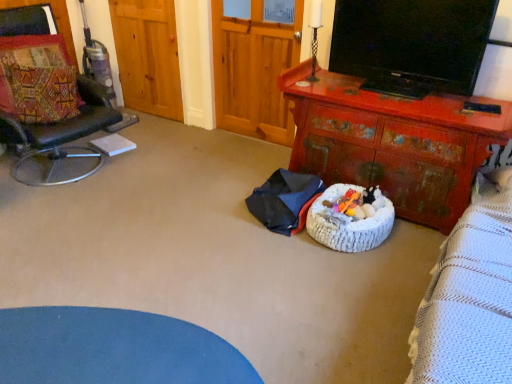
What do you see at coordinates (51, 105) in the screenshot? I see `leather cushioned chair at left` at bounding box center [51, 105].

Measure the distance between rusty wood desk at center and camera.

The depth of rusty wood desk at center is 1.99 meters.

The image size is (512, 384). Describe the element at coordinates (412, 44) in the screenshot. I see `black glossy tv at upper right` at that location.

Identify the location of wooden armoire at center. (254, 72).

This screenshot has width=512, height=384. Describe the element at coordinates (348, 202) in the screenshot. I see `plush multicolored toy at center` at that location.

The width and height of the screenshot is (512, 384). In order to click on leather cushioned chair at left in this screenshot , I will do click(x=51, y=105).

Is point (17, 63) positioned before point (335, 210)?

No.

Is leather cushioned chair at left looking in the opposite direction of plush multicolored toy at center?

leather cushioned chair at left is not turned away from plush multicolored toy at center.

Is leather cushioned chair at left directly adjacent to plush multicolored toy at center?

leather cushioned chair at left is not next to plush multicolored toy at center, and they're not touching.

Consider the image. From a real-world perspective, is leather cushioned chair at left under plush multicolored toy at center?

Incorrect, from a real-world perspective, leather cushioned chair at left is higher than plush multicolored toy at center.

Which is farther, (339, 201) or (271, 126)?

The point (271, 126) is more distant.

From a real-world perspective, is plush multicolored toy at center beneath wooden armoire at center?

Yes, from a real-world perspective, plush multicolored toy at center is under wooden armoire at center.

From the image's perspective, is plush multicolored toy at center located above or below wooden armoire at center?

plush multicolored toy at center is below wooden armoire at center.

Looking at this image, is plush multicolored toy at center thinner than wooden armoire at center?

Correct, the width of plush multicolored toy at center is less than that of wooden armoire at center.

Is black glossy tv at upper right closer to camera compared to wooden armoire at center?

Yes, it is in front of wooden armoire at center.

From a real-world perspective, between black glossy tv at upper right and wooden armoire at center, who is vertically higher?

From a 3D spatial view, black glossy tv at upper right is above.

Consider the image. Is black glossy tv at upper right situated inside wooden armoire at center or outside?

black glossy tv at upper right is spatially situated outside wooden armoire at center.

You are a GUI agent. You are given a task and a screenshot of the screen. Output one action in this format:
    pyautogui.click(x=<x>, y=<y>)
    Task: Click on the armoire on the left side of black glossy tv at upper right
    The image size is (512, 384).
    Given the screenshot: What is the action you would take?
    pyautogui.click(x=254, y=72)

In the scene shown: Looking at the image, does patchwork fabric pillow at left seem bigger or smaller compared to leather cushioned chair at left?

Clearly, patchwork fabric pillow at left is smaller in size than leather cushioned chair at left.

Between patchwork fabric pillow at left and leather cushioned chair at left, which one appears on the right side from the viewer's perspective?

From the viewer's perspective, leather cushioned chair at left appears more on the right side.

From a real-world perspective, which is physically below, patchwork fabric pillow at left or leather cushioned chair at left?

From a 3D spatial view, leather cushioned chair at left is below.

Looking at this image, is patchwork fabric pillow at left surrounding leather cushioned chair at left?

No, leather cushioned chair at left is not a part of patchwork fabric pillow at left.

Could patchwork fabric pillow at left be considered to be inside leather cushioned chair at left?

Yes, patchwork fabric pillow at left is a part of leather cushioned chair at left.

Is leather cushioned chair at left smaller than patchwork fabric pillow at left?

No.

Which is nearer, (42, 151) or (0, 68)?

The point (0, 68) is more forward.

From the image's perspective, is leather cushioned chair at left positioned above or below patchwork fabric pillow at left?

leather cushioned chair at left is below patchwork fabric pillow at left.

Is black glossy tv at upper right touching plush multicolored toy at center?

No.

Is black glossy tv at upper right at the right side of plush multicolored toy at center?

Yes.

From a real-world perspective, is black glossy tv at upper right positioned above or below plush multicolored toy at center?

Clearly, from a real-world perspective, black glossy tv at upper right is above plush multicolored toy at center.

Are leather cushioned chair at left and black glossy tv at upper right far apart?

Indeed, leather cushioned chair at left is not near black glossy tv at upper right.

Considering the relative sizes of leather cushioned chair at left and black glossy tv at upper right in the image provided, is leather cushioned chair at left taller than black glossy tv at upper right?

Yes.

Considering the relative positions of leather cushioned chair at left and black glossy tv at upper right in the image provided, is leather cushioned chair at left to the left of black glossy tv at upper right from the viewer's perspective?

Indeed, leather cushioned chair at left is positioned on the left side of black glossy tv at upper right.

Looking at their sizes, would you say leather cushioned chair at left is wider or thinner than black glossy tv at upper right?

In the image, leather cushioned chair at left appears to be wider than black glossy tv at upper right.

Find the location of a particular element. Image resolution: width=512 pixels, height=384 pixels. chair above the plush multicolored toy at center (from a real-world perspective) is located at coordinates (51, 105).

Identify the location of toy that appears below the wooden armoire at center (from the image's perspective). (348, 202).

Estimate the real-world distances between objects in this image. Which object is closer to leather cushioned chair at left, white knitted infant bed at center or black glossy tv at upper right?

Based on the image, white knitted infant bed at center appears to be nearer to leather cushioned chair at left.

Based on their spatial positions, is black glossy tv at upper right or patchwork fabric pillow at left closer to leather cushioned chair at left?

Based on the image, patchwork fabric pillow at left appears to be nearer to leather cushioned chair at left.

From the image, which object appears to be nearer to patchwork fabric pillow at left, wooden armoire at center or plush multicolored toy at center?

Based on the image, wooden armoire at center appears to be nearer to patchwork fabric pillow at left.

In the scene shown: Estimate the real-world distances between objects in this image. Which object is closer to leather cushioned chair at left, black glossy tv at upper right or white knitted infant bed at center?

Among the two, white knitted infant bed at center is located nearer to leather cushioned chair at left.

From the picture: From the image, which object appears to be nearer to rusty wood desk at center, wooden armoire at center or patchwork fabric pillow at left?

The object closer to rusty wood desk at center is wooden armoire at center.

When comparing their distances from white knitted infant bed at center, does plush multicolored toy at center or patchwork fabric pillow at left seem closer?

plush multicolored toy at center is positioned closer to the anchor white knitted infant bed at center.

Looking at this image, estimate the real-world distances between objects in this image. Which object is further from patchwork fabric pillow at left, plush multicolored toy at center or leather cushioned chair at left?

plush multicolored toy at center is further to patchwork fabric pillow at left.

Looking at the image, which one is located closer to patchwork fabric pillow at left, leather cushioned chair at left or wooden armoire at center?

leather cushioned chair at left is closer to patchwork fabric pillow at left.

Where is `toy between leather cushioned chair at left and white knitted infant bed at center in the horizontal direction`? The width and height of the screenshot is (512, 384). toy between leather cushioned chair at left and white knitted infant bed at center in the horizontal direction is located at coordinates (348, 202).

Locate an element on the screen. This screenshot has height=384, width=512. desk between black glossy tv at upper right and white knitted infant bed at center from top to bottom is located at coordinates (394, 142).

Find the location of a particular element. Image resolution: width=512 pixels, height=384 pixels. toy between patchwork fabric pillow at left and white knitted infant bed at center from left to right is located at coordinates (348, 202).

Locate an element on the screen. chair between patchwork fabric pillow at left and plush multicolored toy at center is located at coordinates (51, 105).